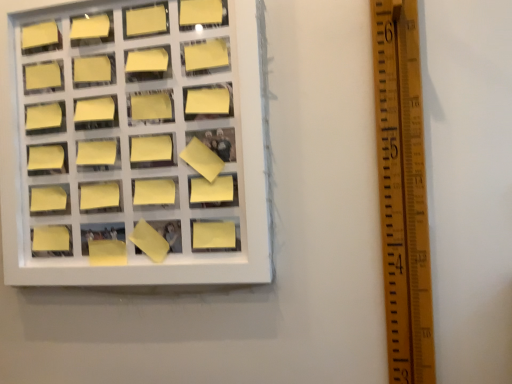
Question: Is yellow matte sticky note at center-left, the third square in the bottom-to-top sequence, completely or partially outside of yellow matte sticky note at upper center, placed as the 3th square when sorted from top to bottom?

Choices:
 (A) no
 (B) yes

Answer: (B)

Question: From the image's perspective, is yellow matte sticky note at center-left, which is the 9th square in top-to-bottom order, located beneath yellow matte sticky note at upper center, the ninth square in the bottom-to-top sequence?

Choices:
 (A) no
 (B) yes

Answer: (B)

Question: Is yellow matte sticky note at center-left, which is the 9th square in top-to-bottom order, positioned with its back to yellow matte sticky note at upper center, the ninth square in the bottom-to-top sequence?

Choices:
 (A) no
 (B) yes

Answer: (A)

Question: Is yellow matte sticky note at center-left, the third square in the bottom-to-top sequence, bigger than yellow matte sticky note at upper center, placed as the 3th square when sorted from top to bottom?

Choices:
 (A) no
 (B) yes

Answer: (B)

Question: Does yellow matte sticky note at center-left, the third square in the bottom-to-top sequence, have a lesser width compared to yellow matte sticky note at upper center, the ninth square in the bottom-to-top sequence?

Choices:
 (A) no
 (B) yes

Answer: (A)

Question: In terms of size, does yellow matte sticky note at center, the 7th square when ordered from bottom to top, appear bigger or smaller than white plastic frame at upper left?

Choices:
 (A) small
 (B) big

Answer: (A)

Question: Considering the positions of yellow matte sticky note at center, the 7th square when ordered from bottom to top, and white plastic frame at upper left in the image, is yellow matte sticky note at center, the 7th square when ordered from bottom to top, wider or thinner than white plastic frame at upper left?

Choices:
 (A) thin
 (B) wide

Answer: (A)

Question: From a real-world perspective, relative to white plastic frame at upper left, is yellow matte sticky note at center, the 7th square when ordered from bottom to top, vertically above or below?

Choices:
 (A) above
 (B) below

Answer: (A)

Question: Is point (204, 107) closer or farther from the camera than point (199, 271)?

Choices:
 (A) farther
 (B) closer

Answer: (A)

Question: From a real-world perspective, is yellow matte sticky note at upper left, arranged as the 8th square when ordered from the bottom, physically located above or below yellow matte sticky note at center-left, the second square positioned from the bottom?

Choices:
 (A) below
 (B) above

Answer: (B)

Question: Considering their positions, is yellow matte sticky note at upper left, marked as the 4th square in a top-to-bottom arrangement, located in front of or behind yellow matte sticky note at center-left, the second square positioned from the bottom?

Choices:
 (A) behind
 (B) front

Answer: (A)

Question: Considering the positions of yellow matte sticky note at upper left, arranged as the 8th square when ordered from the bottom, and yellow matte sticky note at center-left, the second square positioned from the bottom, in the image, is yellow matte sticky note at upper left, arranged as the 8th square when ordered from the bottom, wider or thinner than yellow matte sticky note at center-left, the second square positioned from the bottom,?

Choices:
 (A) thin
 (B) wide

Answer: (A)

Question: Considering the positions of point (99, 77) and point (87, 200), is point (99, 77) closer or farther from the camera than point (87, 200)?

Choices:
 (A) farther
 (B) closer

Answer: (B)

Question: Does point (136, 190) appear closer or farther from the camera than point (199, 203)?

Choices:
 (A) closer
 (B) farther

Answer: (B)

Question: Looking at their shapes, would you say yellow matte sticky note at center-left, the third square in the bottom-to-top sequence, is wider or thinner than white plastic frame at upper left?

Choices:
 (A) wide
 (B) thin

Answer: (B)